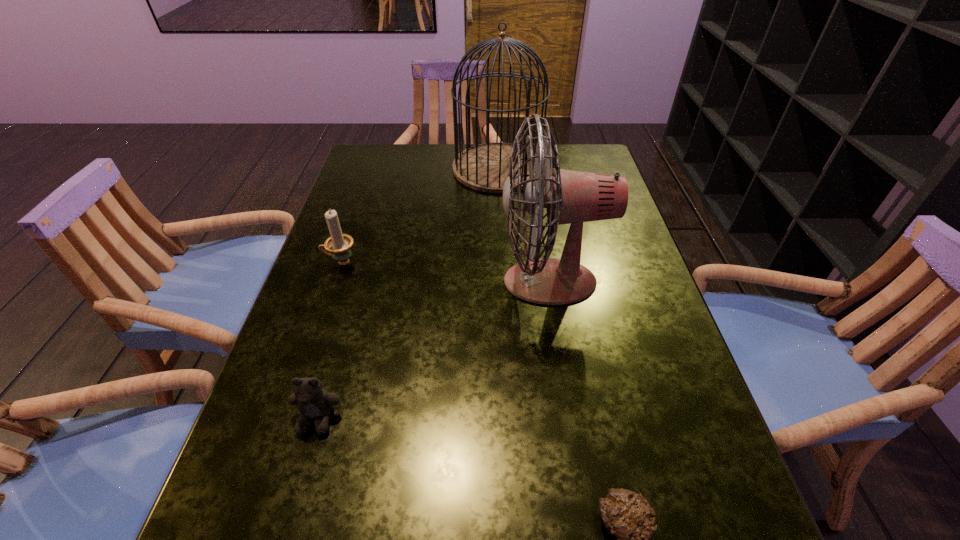
You are a GUI agent. You are given a task and a screenshot of the screen. Output one action in this format:
    pyautogui.click(x=<x>, y=<y>)
    Task: Click on the empty location between the fan and the candle_holder
    This screenshot has width=960, height=540.
    Given the screenshot: What is the action you would take?
    point(445,272)

The image size is (960, 540). What are the coordinates of `vacant space in between the fourth farthest object and the third tallest object` in the screenshot? It's located at (329, 340).

Find the location of `free space between the birdcage and the candle_holder`. free space between the birdcage and the candle_holder is located at coordinates (420, 215).

The width and height of the screenshot is (960, 540). In order to click on empty location between the fourth farthest object and the fan in this screenshot , I will do `click(434, 350)`.

Locate an element on the screen. The width and height of the screenshot is (960, 540). object that stands as the closest to the second shortest object is located at coordinates (570, 197).

Locate an element on the screen. This screenshot has width=960, height=540. object that stands as the second closest to the candle_holder is located at coordinates (570, 197).

Image resolution: width=960 pixels, height=540 pixels. I want to click on vacant point that satisfies the following two spatial constraints: 1. at the door of the birdcage; 2. on the face of the teddy bear, so click(512, 419).

At what (x,y) coordinates should I click in order to perform the action: click on vacant region that satisfies the following two spatial constraints: 1. in front of the fan to direct airflow; 2. on the face of the second nearest object. Please return your answer as a coordinate pair (x, y). Looking at the image, I should click on (572, 419).